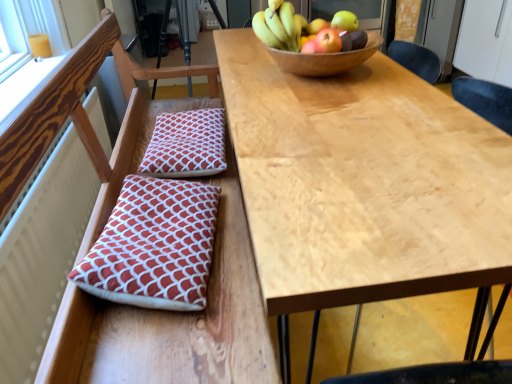
Question: Considering the relative sizes of red-patterned cushion at left and red cotton cushion at center, marked as the second pillow in a front-to-back arrangement, in the image provided, is red-patterned cushion at left thinner than red cotton cushion at center, marked as the second pillow in a front-to-back arrangement,?

Choices:
 (A) yes
 (B) no

Answer: (B)

Question: Can you confirm if red-patterned cushion at left is smaller than red cotton cushion at center, the 1th pillow viewed from the top?

Choices:
 (A) no
 (B) yes

Answer: (A)

Question: Is red-patterned cushion at left at the left side of red cotton cushion at center, the 1th pillow viewed from the top?

Choices:
 (A) no
 (B) yes

Answer: (A)

Question: From a real-world perspective, does red-patterned cushion at left sit lower than red cotton cushion at center, marked as the second pillow in a front-to-back arrangement?

Choices:
 (A) no
 (B) yes

Answer: (B)

Question: Is red-patterned cushion at left positioned behind red cotton cushion at center, positioned as the 1th pillow in back-to-front order?

Choices:
 (A) yes
 (B) no

Answer: (B)

Question: In the image, is shiny yellow apple at upper right, the 2th apple in the front-to-back sequence, positioned in front of or behind shiny green apple at upper center, the 1th apple positioned from the back?

Choices:
 (A) front
 (B) behind

Answer: (A)

Question: In terms of width, does shiny yellow apple at upper right, acting as the 2th apple starting from the back, look wider or thinner when compared to shiny green apple at upper center, the 1th apple positioned from the back?

Choices:
 (A) thin
 (B) wide

Answer: (A)

Question: Is point (348, 11) closer or farther from the camera than point (310, 23)?

Choices:
 (A) farther
 (B) closer

Answer: (A)

Question: Based on their sizes in the image, would you say shiny yellow apple at upper right, the 2th apple in the front-to-back sequence, is bigger or smaller than shiny green apple at upper center, the 1th apple positioned from the back?

Choices:
 (A) big
 (B) small

Answer: (B)

Question: Do you think wooden bowl at upper center is within yellow matte bananas at upper center, or outside of it?

Choices:
 (A) outside
 (B) inside

Answer: (A)

Question: Looking at the image, does wooden bowl at upper center seem bigger or smaller compared to yellow matte bananas at upper center?

Choices:
 (A) small
 (B) big

Answer: (B)

Question: From their relative heights in the image, would you say wooden bowl at upper center is taller or shorter than yellow matte bananas at upper center?

Choices:
 (A) short
 (B) tall

Answer: (A)

Question: Is point (330, 54) closer or farther from the camera than point (287, 39)?

Choices:
 (A) farther
 (B) closer

Answer: (B)

Question: Which is correct: shiny yellow apple at upper right, acting as the 2th apple starting from the back, is inside matte red apple at upper right, the 3th apple when ordered from back to front, or outside of it?

Choices:
 (A) inside
 (B) outside

Answer: (B)

Question: Relative to matte red apple at upper right, the 3th apple when ordered from back to front, is shiny yellow apple at upper right, acting as the 2th apple starting from the back, in front or behind?

Choices:
 (A) front
 (B) behind

Answer: (B)